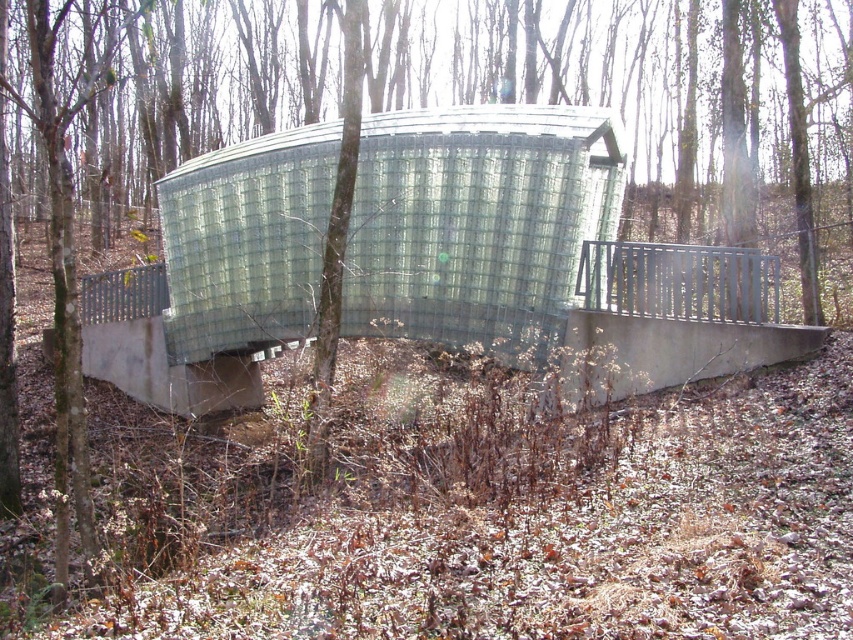
Question: Which object appears closest to the camera in this image?

Choices:
 (A) clear glass shelter at center
 (B) metallic gray rail at center

Answer: (B)

Question: Is the position of clear glass shelter at center less distant than that of metallic gray rail at center?

Choices:
 (A) yes
 (B) no

Answer: (B)

Question: Is clear glass shelter at center to the left of metallic gray rail at center from the viewer's perspective?

Choices:
 (A) yes
 (B) no

Answer: (A)

Question: Is clear glass shelter at center positioned behind metallic gray rail at center?

Choices:
 (A) no
 (B) yes

Answer: (B)

Question: Which of the following is the closest to the observer?

Choices:
 (A) metallic gray rail at center
 (B) clear glass shelter at center

Answer: (A)